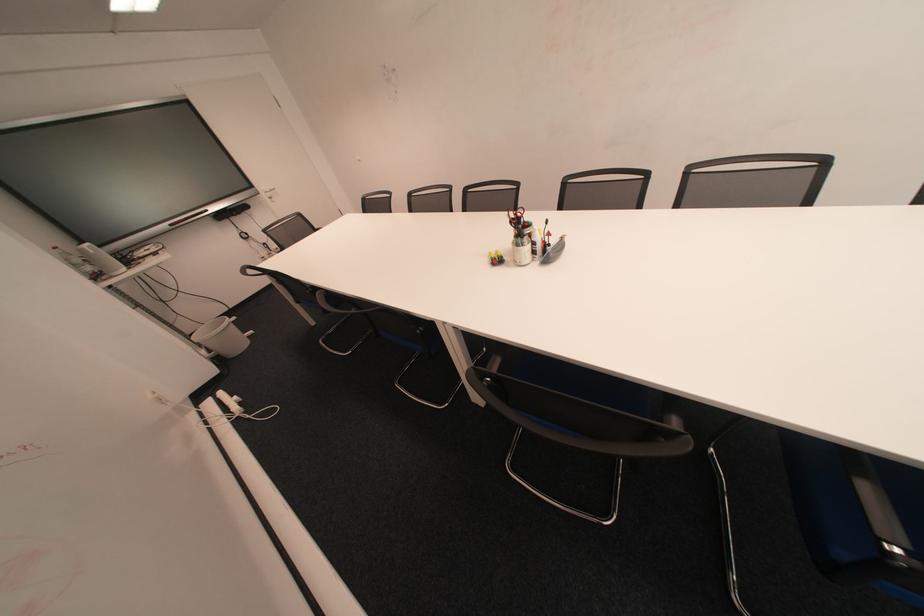
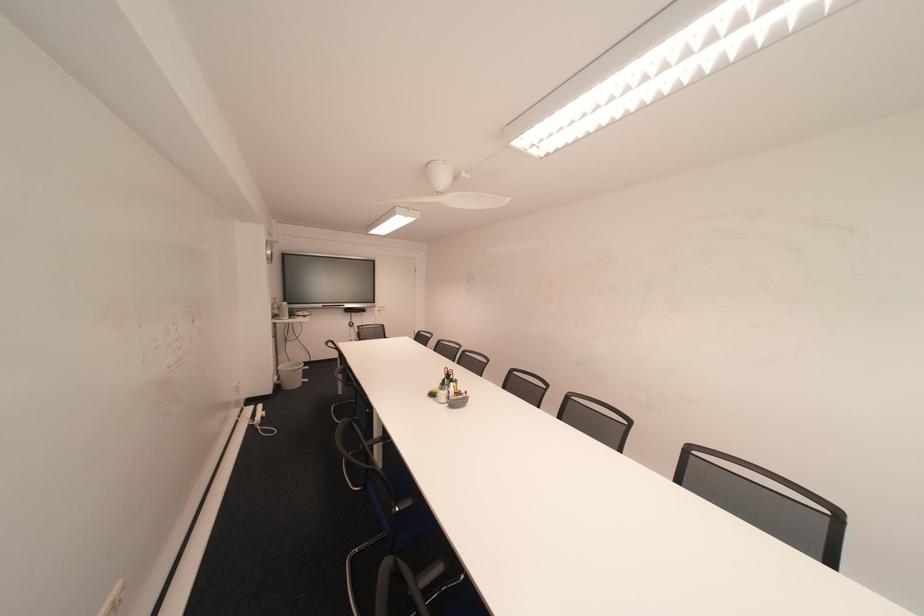
Find the pixel in the second image that matches [229,360] in the first image.

(288, 387)